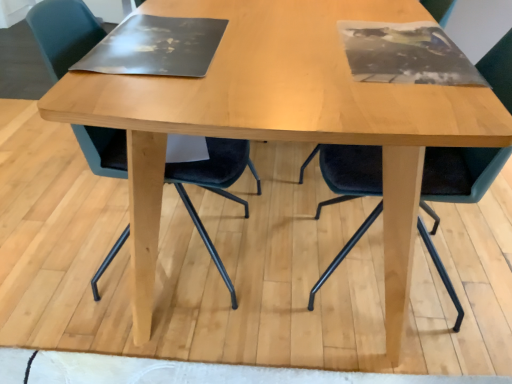
Question: Is velvet dark blue chair at center, the second chair in the left-to-right sequence, directly adjacent to velvet dark green chair at left, which is the 2th chair in right-to-left order?

Choices:
 (A) yes
 (B) no

Answer: (B)

Question: Is velvet dark blue chair at center, the second chair in the left-to-right sequence, wider than velvet dark green chair at left, which is the 2th chair in right-to-left order?

Choices:
 (A) no
 (B) yes

Answer: (A)

Question: Is velvet dark blue chair at center, which ranks as the 1th chair in right-to-left order, further to the viewer compared to velvet dark green chair at left, which is the 2th chair in right-to-left order?

Choices:
 (A) no
 (B) yes

Answer: (A)

Question: Considering the relative sizes of velvet dark blue chair at center, the second chair in the left-to-right sequence, and velvet dark green chair at left, acting as the 1th chair starting from the left, in the image provided, is velvet dark blue chair at center, the second chair in the left-to-right sequence, smaller than velvet dark green chair at left, acting as the 1th chair starting from the left,?

Choices:
 (A) no
 (B) yes

Answer: (B)

Question: From a real-world perspective, is velvet dark blue chair at center, which ranks as the 1th chair in right-to-left order, beneath velvet dark green chair at left, which is the 2th chair in right-to-left order?

Choices:
 (A) yes
 (B) no

Answer: (B)

Question: Would you say velvet dark blue chair at center, the second chair in the left-to-right sequence, is outside velvet dark green chair at left, acting as the 1th chair starting from the left?

Choices:
 (A) yes
 (B) no

Answer: (A)

Question: Is velvet dark green chair at left, acting as the 1th chair starting from the left, outside velvet dark blue chair at center, the second chair in the left-to-right sequence?

Choices:
 (A) no
 (B) yes

Answer: (B)

Question: Is velvet dark green chair at left, acting as the 1th chair starting from the left, in front of velvet dark blue chair at center, the second chair in the left-to-right sequence?

Choices:
 (A) yes
 (B) no

Answer: (B)

Question: Is velvet dark blue chair at center, the second chair in the left-to-right sequence, completely or partially inside velvet dark green chair at left, acting as the 1th chair starting from the left?

Choices:
 (A) yes
 (B) no

Answer: (B)

Question: From the image's perspective, is velvet dark green chair at left, which is the 2th chair in right-to-left order, over velvet dark blue chair at center, the second chair in the left-to-right sequence?

Choices:
 (A) yes
 (B) no

Answer: (A)

Question: From a real-world perspective, is velvet dark green chair at left, acting as the 1th chair starting from the left, positioned under velvet dark blue chair at center, which ranks as the 1th chair in right-to-left order, based on gravity?

Choices:
 (A) yes
 (B) no

Answer: (A)

Question: Considering the relative sizes of velvet dark green chair at left, which is the 2th chair in right-to-left order, and velvet dark blue chair at center, the second chair in the left-to-right sequence, in the image provided, is velvet dark green chair at left, which is the 2th chair in right-to-left order, taller than velvet dark blue chair at center, the second chair in the left-to-right sequence,?

Choices:
 (A) yes
 (B) no

Answer: (A)

Question: Is velvet dark green chair at left, acting as the 1th chair starting from the left, bigger or smaller than velvet dark blue chair at center, which ranks as the 1th chair in right-to-left order?

Choices:
 (A) big
 (B) small

Answer: (A)